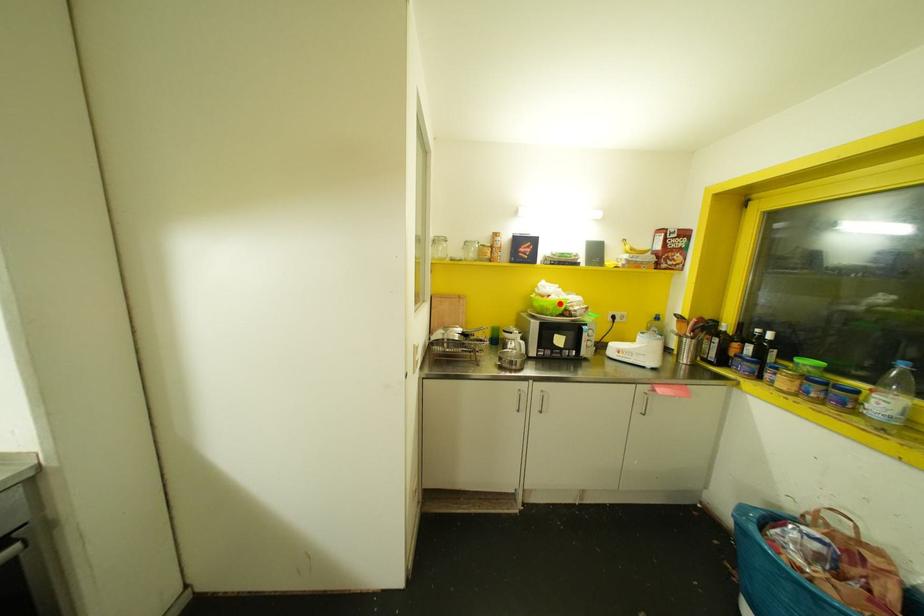
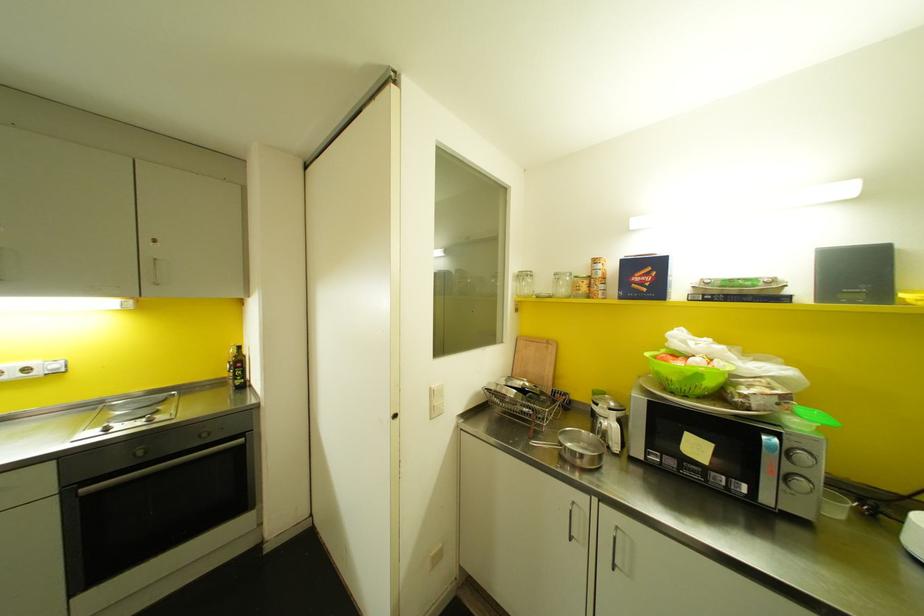
Locate, in the second image, the point that corresponds to the highlighted location in the first image.

(698, 376)